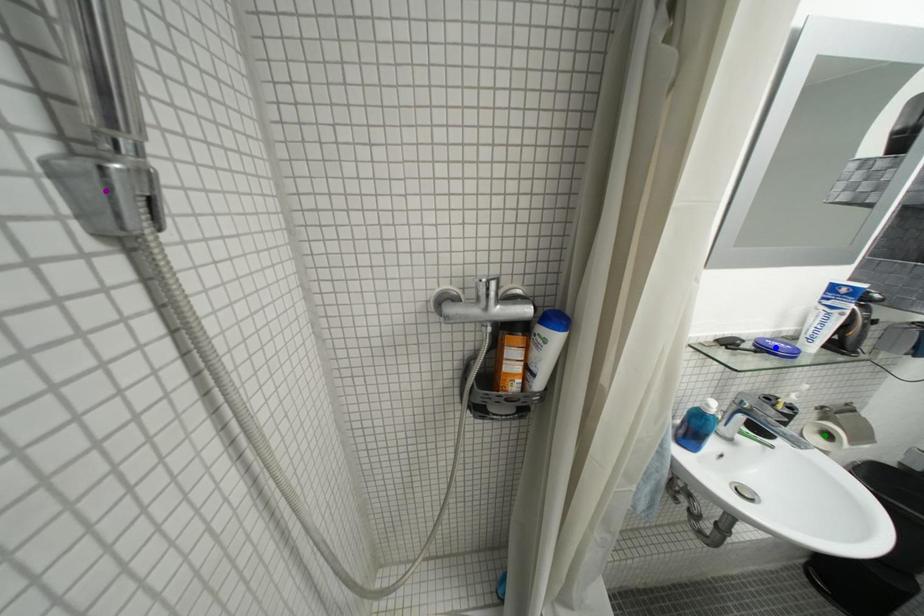
Order these from farthest to nearest:
A) green point
B) blue point
C) purple point

green point < blue point < purple point